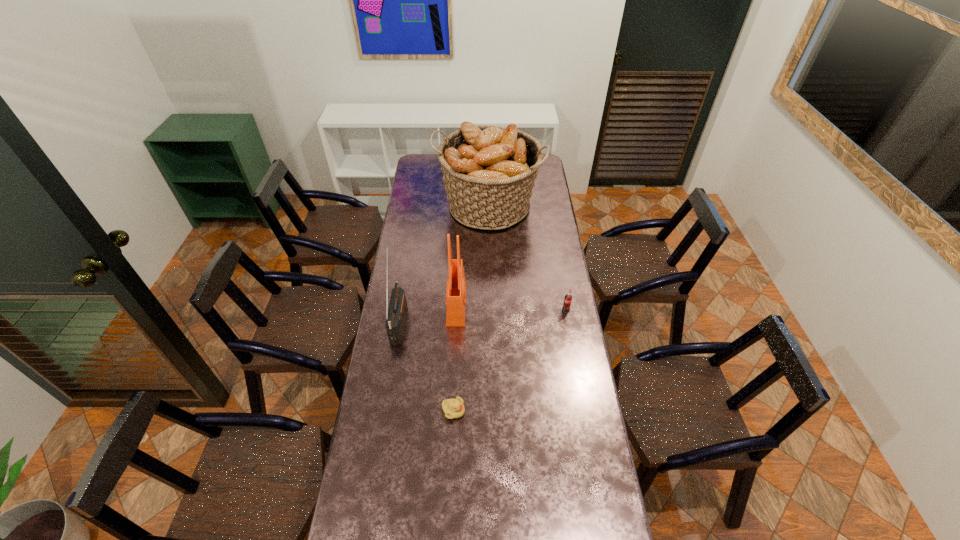
Where is `vacant area situated 0.370m on the front-facing side of the leftmost object`? vacant area situated 0.370m on the front-facing side of the leftmost object is located at coordinates point(492,321).

Where is `vacant area situated on the label of the fourth tallest object`? The image size is (960, 540). vacant area situated on the label of the fourth tallest object is located at coordinates (568, 326).

Locate an element on the screen. free space located 0.100m on the beak of the duckling is located at coordinates (492, 411).

What are the coordinates of `object that is at the left edge` in the screenshot? It's located at (396, 313).

This screenshot has width=960, height=540. I want to click on basket located at the right edge, so click(x=489, y=172).

The width and height of the screenshot is (960, 540). Find the location of `soda bottle located at the right edge`. soda bottle located at the right edge is located at coordinates (568, 298).

Find the location of a particular element. The width and height of the screenshot is (960, 540). vacant space at the left edge of the desktop is located at coordinates (379, 354).

Image resolution: width=960 pixels, height=540 pixels. In the image, there is a desktop. What are the coordinates of `vacant space at the right edge` in the screenshot? It's located at (547, 295).

In the image, there is a desktop. Identify the location of vacant area at the far left corner. (431, 174).

At what (x,y) coordinates should I click in order to perform the action: click on vacant space at the far right corner of the desktop. Please return your answer as a coordinate pair (x, y). The height and width of the screenshot is (540, 960). Looking at the image, I should click on (540, 172).